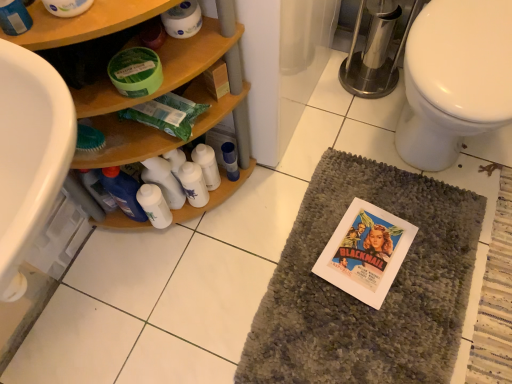
Question: Considering the relative sizes of white paper comic book at center and white matte toilet paper at upper center in the image provided, is white paper comic book at center thinner than white matte toilet paper at upper center?

Choices:
 (A) yes
 (B) no

Answer: (B)

Question: Is the depth of white paper comic book at center less than that of white matte toilet paper at upper center?

Choices:
 (A) yes
 (B) no

Answer: (B)

Question: Is white paper comic book at center smaller than white matte toilet paper at upper center?

Choices:
 (A) no
 (B) yes

Answer: (A)

Question: Can you see white paper comic book at center touching white matte toilet paper at upper center?

Choices:
 (A) no
 (B) yes

Answer: (A)

Question: Is white matte toilet paper at upper center completely or partially inside white paper comic book at center?

Choices:
 (A) no
 (B) yes

Answer: (A)

Question: From the image's perspective, is white matte lotion at center, marked as the 2th toiletry in a right-to-left arrangement, located above or below white paper comic book at center?

Choices:
 (A) above
 (B) below

Answer: (A)

Question: Is white matte lotion at center, marked as the 1th toiletry in a left-to-right arrangement, wider or thinner than white paper comic book at center?

Choices:
 (A) thin
 (B) wide

Answer: (A)

Question: Is white matte lotion at center, marked as the 1th toiletry in a left-to-right arrangement, inside or outside of white paper comic book at center?

Choices:
 (A) outside
 (B) inside

Answer: (A)

Question: Considering the positions of white matte lotion at center, marked as the 1th toiletry in a left-to-right arrangement, and white paper comic book at center in the image, is white matte lotion at center, marked as the 1th toiletry in a left-to-right arrangement, bigger or smaller than white paper comic book at center?

Choices:
 (A) big
 (B) small

Answer: (A)

Question: From a real-world perspective, relative to woodenmaterial/texturebathroom cabinet at left, is blue glossy bottle at center, the second bottle from the left, vertically above or below?

Choices:
 (A) below
 (B) above

Answer: (A)

Question: Would you say blue glossy bottle at center, the first bottle positioned from the right, is inside or outside woodenmaterial/texturebathroom cabinet at left?

Choices:
 (A) inside
 (B) outside

Answer: (A)

Question: Based on their sizes in the image, would you say blue glossy bottle at center, the second bottle from the left, is bigger or smaller than woodenmaterial/texturebathroom cabinet at left?

Choices:
 (A) small
 (B) big

Answer: (A)

Question: In the image, is blue glossy bottle at center, the second bottle from the left, on the left side or the right side of woodenmaterial/texturebathroom cabinet at left?

Choices:
 (A) left
 (B) right

Answer: (B)

Question: Is white plastic bottles at center, the 2th bottle in the right-to-left sequence, in front of or behind blue glossy bottle at center, the second bottle from the left, in the image?

Choices:
 (A) behind
 (B) front

Answer: (B)

Question: From a real-world perspective, is white plastic bottles at center, positioned as the 1th bottle in left-to-right order, above or below blue glossy bottle at center, the first bottle positioned from the right?

Choices:
 (A) above
 (B) below

Answer: (A)